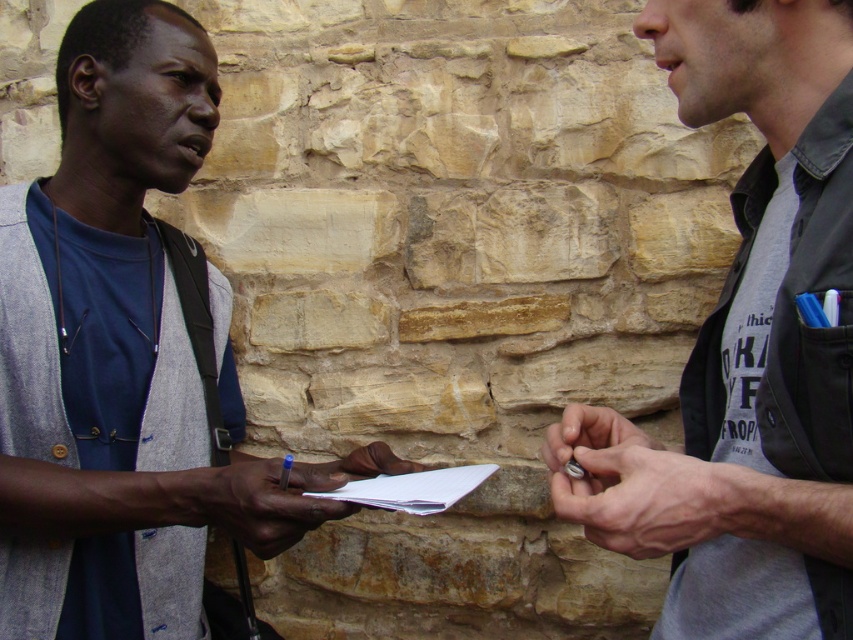
Based on the coordinates provided, which object corresponds to the point at (x=120, y=356) in the image?

The point at (x=120, y=356) corresponds to the matte gray vest at left.

You are a photographer standing in front of the scene. You want to take a closeup photo of the gray fabric shirt at right. The minimum focusing distance of your camera is 1 meter. Can you take the photo without moving closer?

The gray fabric shirt at right is 95.26 centimeters from the viewer. Since the minimum focusing distance is 1 meter, the camera cannot focus at that distance. You need to move back or use a different lens.

In the scene shown: You are a photographer standing in front of the two people in the image. You want to take a photo of the white paper at center without the smooth paper at center blocking it. Which direction should you move to achieve this?

You should move to the right side because the smooth paper at center is closer to you, so moving sideways will allow you to position yourself where the white paper at center is no longer blocked by the smooth paper at center.